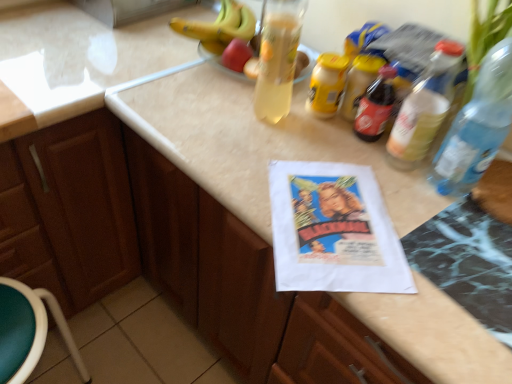
Question: Would you say brown wood cabinet at left is outside transparent plastic bottle at right, the second bottle positioned from the left?

Choices:
 (A) yes
 (B) no

Answer: (A)

Question: Is brown wood cabinet at left taller than transparent plastic bottle at right, the second bottle positioned from the left?

Choices:
 (A) yes
 (B) no

Answer: (A)

Question: Can you confirm if brown wood cabinet at left is wider than transparent plastic bottle at right, the 1th bottle when ordered from right to left?

Choices:
 (A) yes
 (B) no

Answer: (A)

Question: Can you confirm if brown wood cabinet at left is thinner than transparent plastic bottle at right, the 1th bottle when ordered from right to left?

Choices:
 (A) no
 (B) yes

Answer: (A)

Question: Is brown wood cabinet at left smaller than transparent plastic bottle at right, the second bottle positioned from the left?

Choices:
 (A) no
 (B) yes

Answer: (A)

Question: Is the depth of brown wood cabinet at left greater than that of transparent plastic bottle at right, the 1th bottle when ordered from right to left?

Choices:
 (A) no
 (B) yes

Answer: (B)

Question: Considering the relative sizes of brown wood cabinet at left and translucent plastic bottle at upper right, which is the second bottle in right-to-left order, in the image provided, is brown wood cabinet at left bigger than translucent plastic bottle at upper right, which is the second bottle in right-to-left order,?

Choices:
 (A) yes
 (B) no

Answer: (A)

Question: Could you tell me if brown wood cabinet at left is turned towards translucent plastic bottle at upper right, which is the first bottle in left-to-right order?

Choices:
 (A) no
 (B) yes

Answer: (A)

Question: Is brown wood cabinet at left with translucent plastic bottle at upper right, which is the first bottle in left-to-right order?

Choices:
 (A) no
 (B) yes

Answer: (A)

Question: Is brown wood cabinet at left taller than translucent plastic bottle at upper right, which is the first bottle in left-to-right order?

Choices:
 (A) no
 (B) yes

Answer: (B)

Question: Can we say brown wood cabinet at left lies outside translucent plastic bottle at upper right, which is the second bottle in right-to-left order?

Choices:
 (A) no
 (B) yes

Answer: (B)

Question: Is brown wood cabinet at left positioned far away from translucent plastic bottle at upper right, which is the first bottle in left-to-right order?

Choices:
 (A) no
 (B) yes

Answer: (A)

Question: Is transparent plastic bottle at right, the 1th bottle when ordered from right to left, oriented towards translucent plastic bottle at upper right, which is the second bottle in right-to-left order?

Choices:
 (A) yes
 (B) no

Answer: (B)